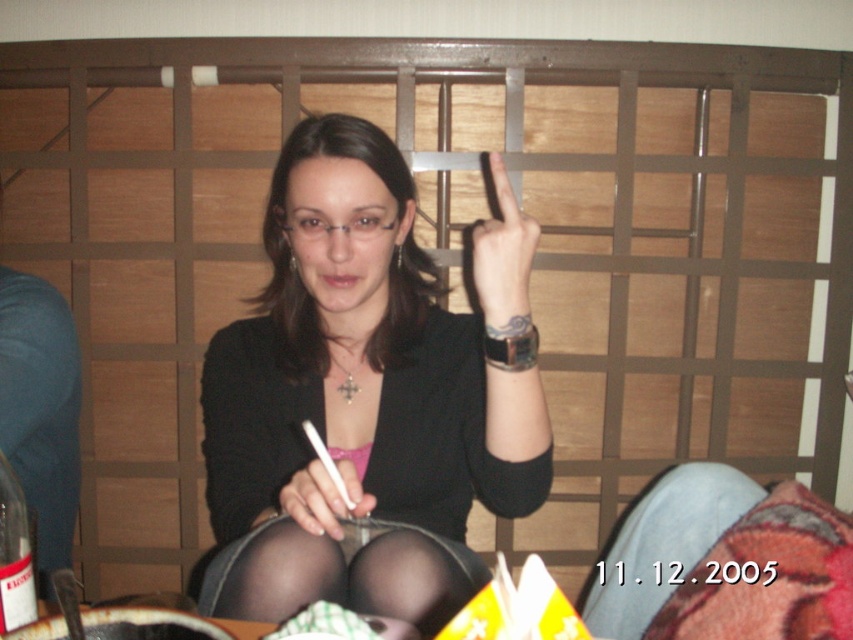
Question: Can you confirm if matte black sweater at center is positioned above denim at lower right?

Choices:
 (A) yes
 (B) no

Answer: (A)

Question: Which point is farther to the camera?

Choices:
 (A) matte black sweater at center
 (B) denim at lower right

Answer: (B)

Question: Is matte black sweater at center wider than smooth skin finger at upper center?

Choices:
 (A) yes
 (B) no

Answer: (A)

Question: Estimate the real-world distances between objects in this image. Which object is closer to the black sheer tights at lower center?

Choices:
 (A) matte black sweater at center
 (B) smooth skin finger at upper center
 (C) matte white pen at center
 (D) denim at lower right

Answer: (C)

Question: Does matte white pen at center have a greater width compared to black sheer tights at lower center?

Choices:
 (A) no
 (B) yes

Answer: (A)

Question: Which of the following is the closest to the observer?

Choices:
 (A) (222, 557)
 (B) (666, 481)
 (C) (508, 289)

Answer: (C)